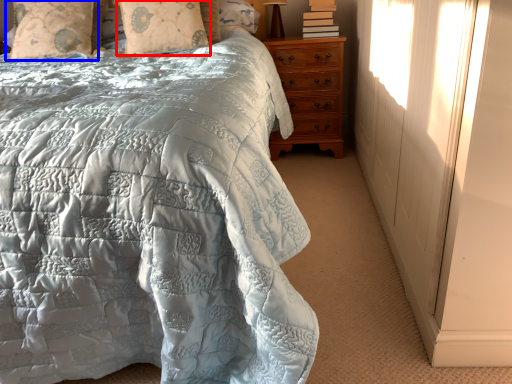
Question: Which object appears closest to the camera in this image, pillow (highlighted by a red box) or pillow (highlighted by a blue box)?

Choices:
 (A) pillow
 (B) pillow

Answer: (A)